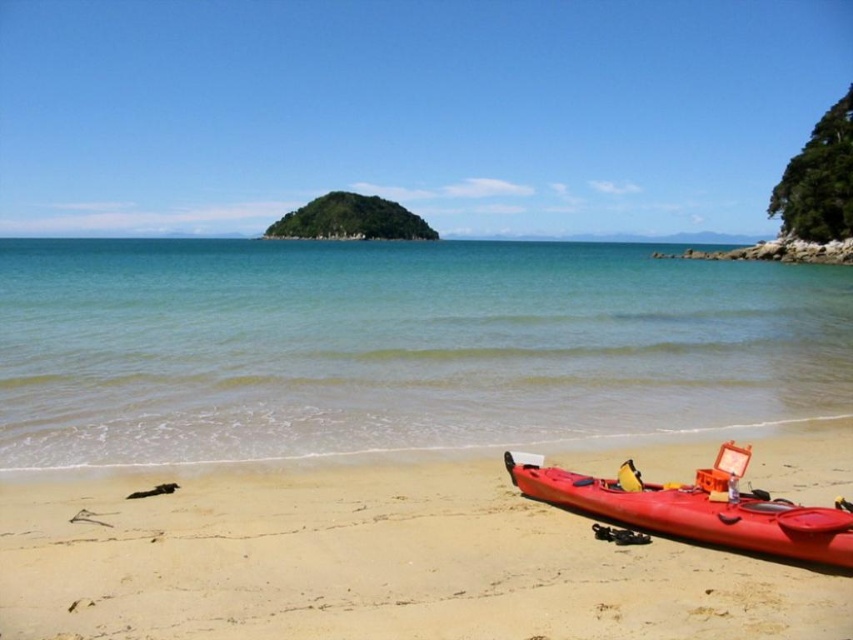
Does clear blue water at center appear under smooth sand at lower right?

Incorrect, clear blue water at center is not positioned below smooth sand at lower right.

Is point (561, 314) farther from viewer compared to point (602, 577)?

Yes, point (561, 314) is behind point (602, 577).

At what (x,y) coordinates should I click in order to perform the action: click on clear blue water at center. Please return your answer as a coordinate pair (x, y). Looking at the image, I should click on (397, 346).

Can you confirm if clear blue water at center is positioned above matte orange kayak at lower right?

Correct, clear blue water at center is located above matte orange kayak at lower right.

Is clear blue water at center positioned in front of matte orange kayak at lower right?

No, clear blue water at center is behind matte orange kayak at lower right.

The image size is (853, 640). Find the location of `clear blue water at center`. clear blue water at center is located at coordinates (397, 346).

Who is more forward, (552, 532) or (680, 515)?

Point (680, 515) is more forward.

Between point (560, 609) and point (744, 518), which one is positioned behind?

The point (744, 518) is behind.

Is point (469, 467) positioned in front of point (651, 492)?

That is False.

Where is `smooth sand at lower right`? The image size is (853, 640). smooth sand at lower right is located at coordinates (372, 563).